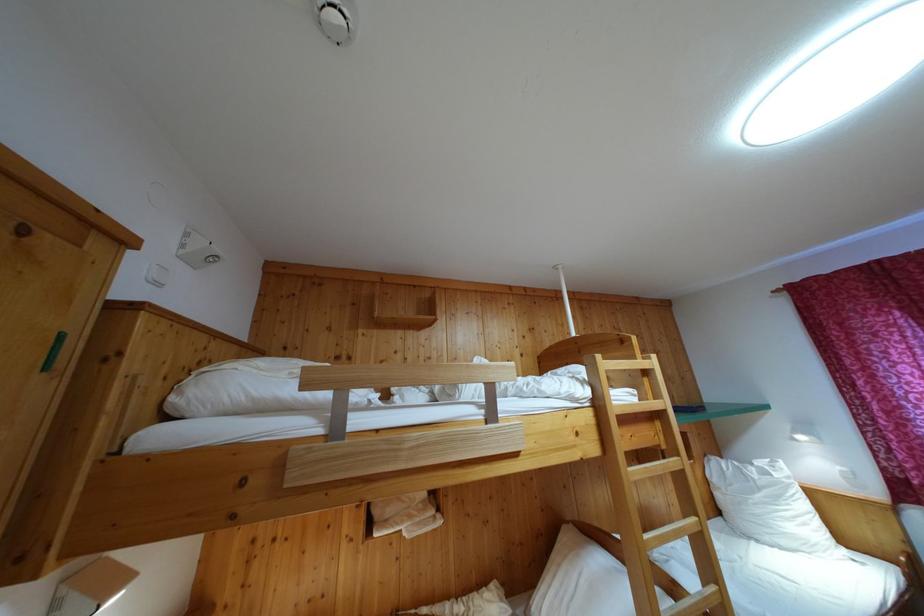
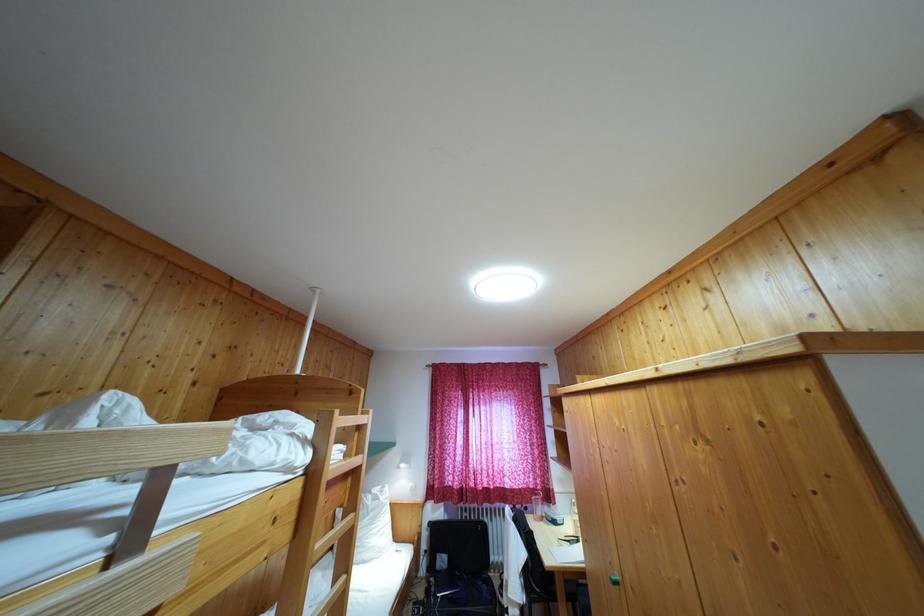
Find the pixel in the second image that matches [602,411] in the first image.

(317, 479)